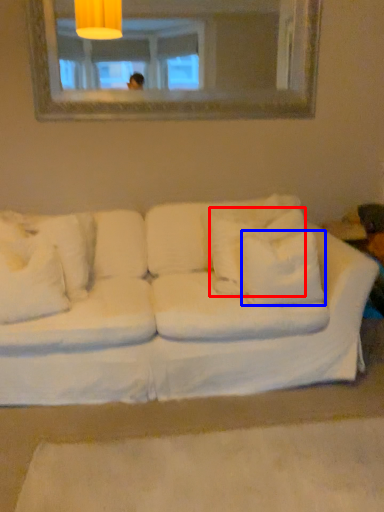
Question: Which object is further to the camera taking this photo, pillow (highlighted by a red box) or pillow (highlighted by a blue box)?

Choices:
 (A) pillow
 (B) pillow

Answer: (A)